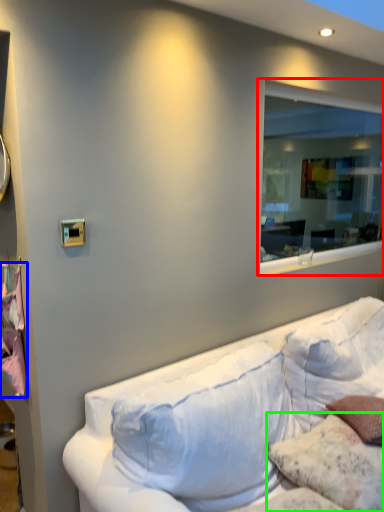
Question: Which object is positioned farthest from window (highlighted by a red box)? Select from sheet (highlighted by a blue box) and pillow (highlighted by a green box).

Choices:
 (A) sheet
 (B) pillow

Answer: (A)